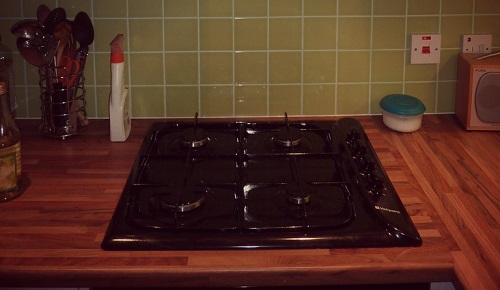
Identify the location of tupperware. This screenshot has width=500, height=290. (407, 111).